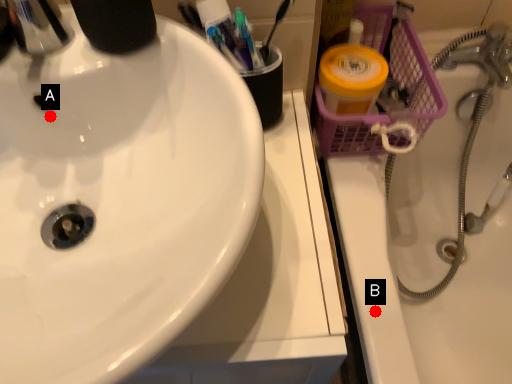
Question: Two points are circled on the image, labeled by A and B beside each circle. Which of the following is the farthest from the observer?

Choices:
 (A) A is further
 (B) B is further

Answer: (B)